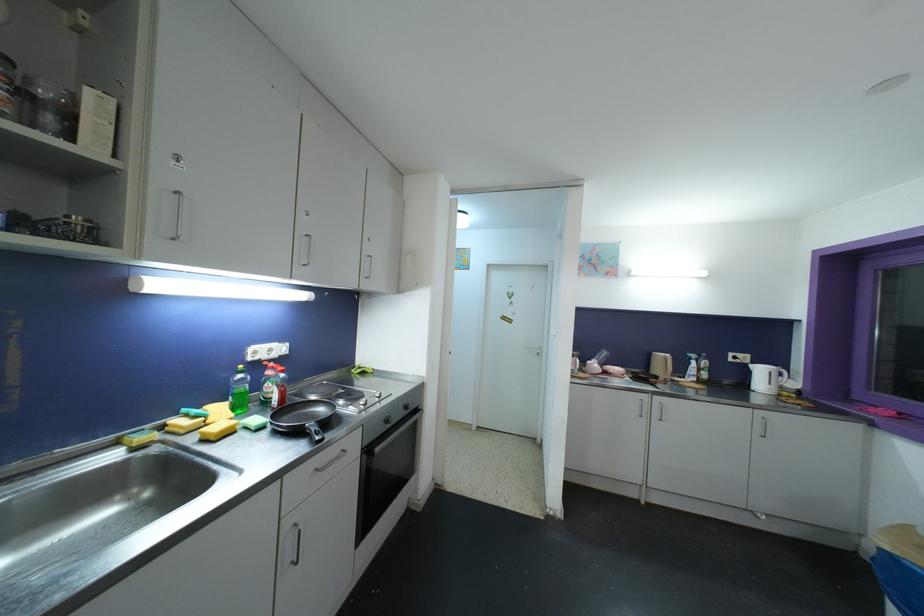
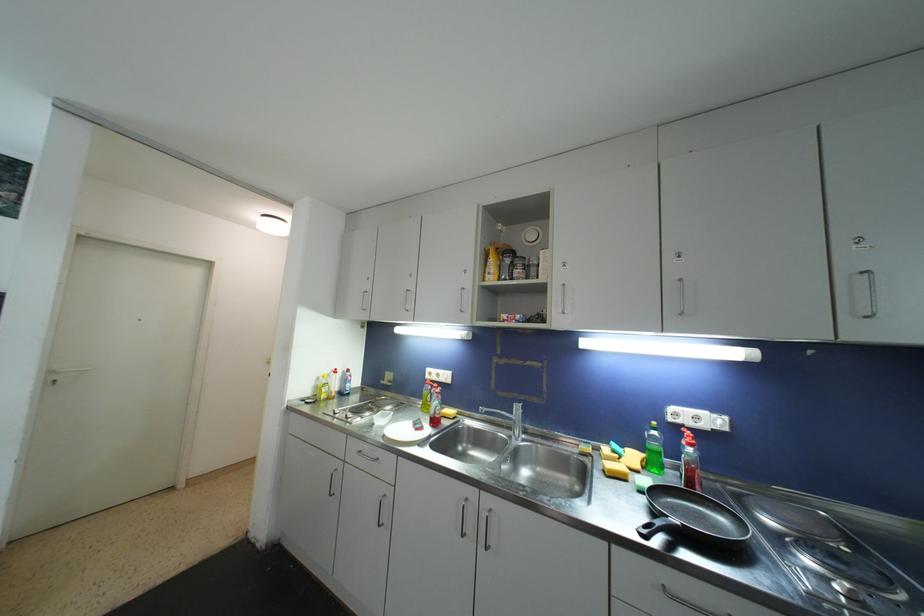
Where in the second image is the point corresponding to point 321,440 from the first image?

(648, 533)